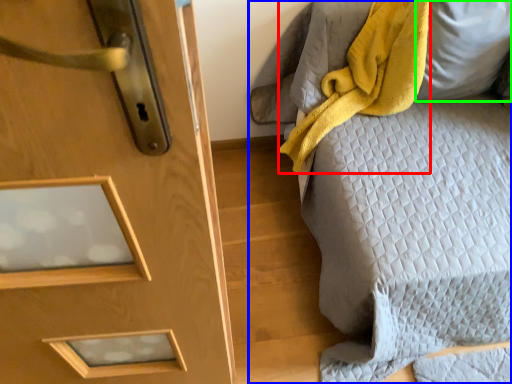
Question: Based on their relative distances, which object is nearer to blanket (highlighted by a red box)? Choose from furniture (highlighted by a blue box) and pillow (highlighted by a green box).

Choices:
 (A) furniture
 (B) pillow

Answer: (B)